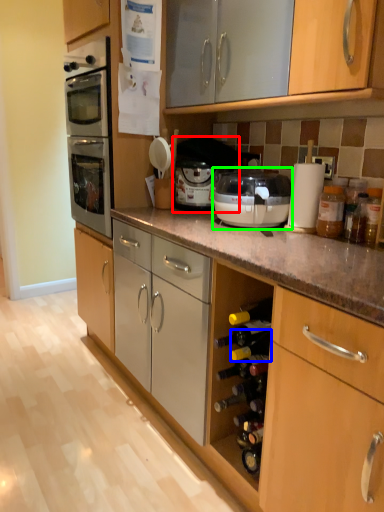
Question: Which is nearer to the appliance (highlighted by a red box)? wine bottle (highlighted by a blue box) or kitchen appliance (highlighted by a green box).

Choices:
 (A) wine bottle
 (B) kitchen appliance

Answer: (B)